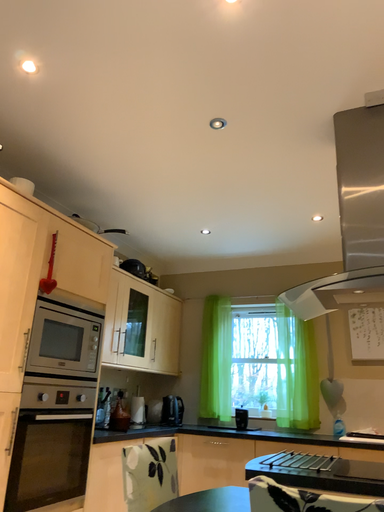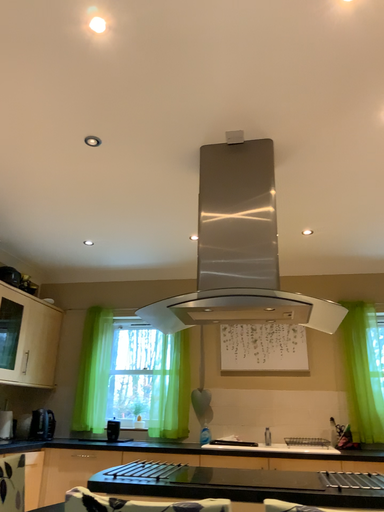
Question: Which way did the camera rotate in the video?

Choices:
 (A) rotated right
 (B) rotated left

Answer: (A)